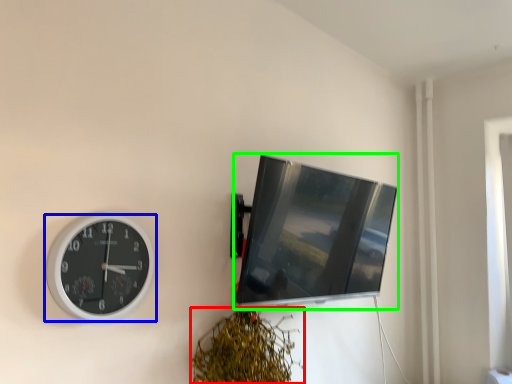
Question: Estimate the real-world distances between objects in this image. Which object is closer to vegetation (highlighted by a red box), wall clock (highlighted by a blue box) or computer monitor (highlighted by a green box)?

Choices:
 (A) wall clock
 (B) computer monitor

Answer: (B)